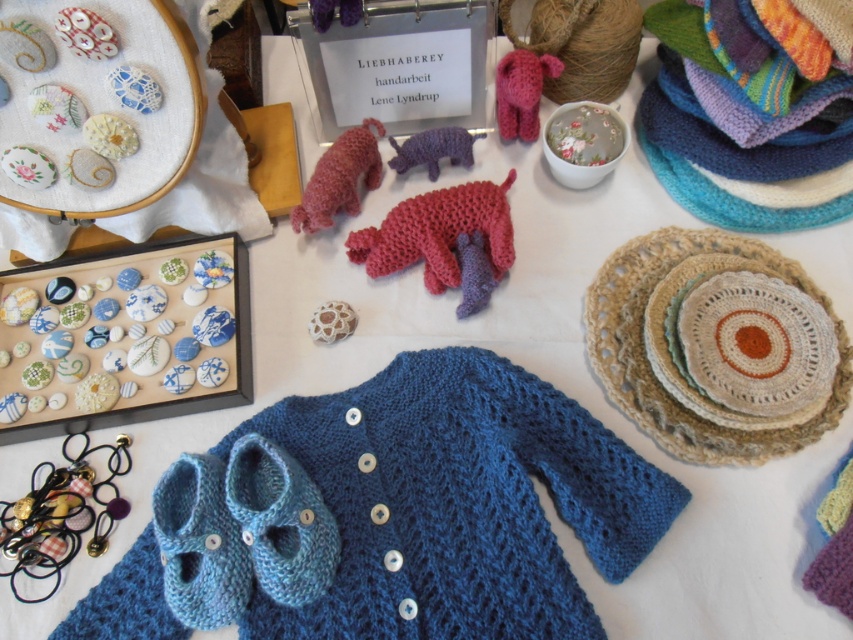
Where is the knitted wool dog at center located in the image?

The knitted wool dog at center is located at the 2D coordinates point (340, 177) in the image.

You are a customer at a craft fair and see the knitted wool dog at center and the white lace button at center on the table. Which item is closer to you?

The knitted wool dog at center is closer to you because it is further to the viewer than the white lace button at center.

You are looking at the handmade crafts on the table. There are two points marked on the image. The first point is at coordinate point (354, 209) and the second is at point (328, 308). Which point is closer to you?

Point (354, 209) is further to the camera than point (328, 308). Therefore, point (328, 308) is closer to you.